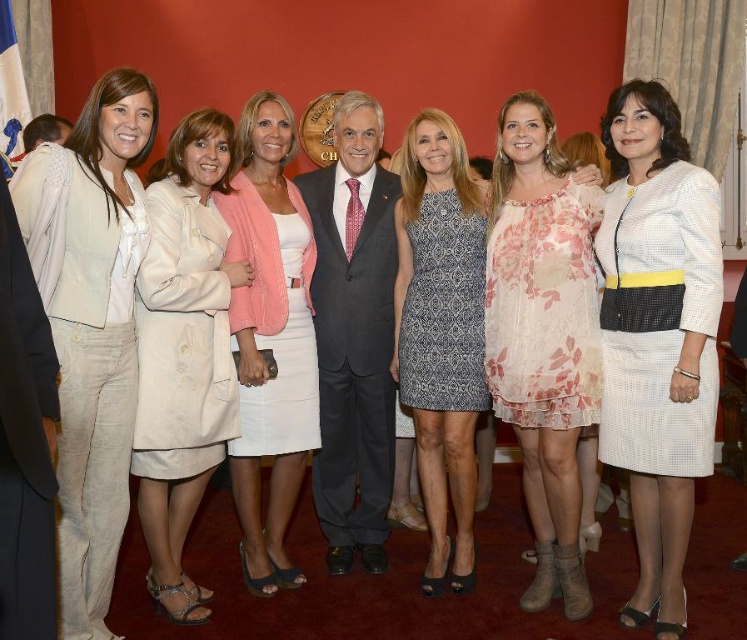
Is floral lace dress at center smaller than light beige fabric coat at center?

Correct, floral lace dress at center occupies less space than light beige fabric coat at center.

Is point (545, 148) closer to viewer compared to point (202, 609)?

No, (545, 148) is behind (202, 609).

This screenshot has width=747, height=640. Identify the location of floral lace dress at center. (542, 333).

Can you confirm if white textured dress at center is thinner than dark gray suit at center?

Indeed, white textured dress at center has a lesser width compared to dark gray suit at center.

Which is in front, point (697, 211) or point (388, 307)?

Positioned in front is point (697, 211).

At what (x,y) coordinates should I click in order to perform the action: click on white textured dress at center. Please return your answer as a coordinate pair (x, y). The height and width of the screenshot is (640, 747). Looking at the image, I should click on (657, 337).

Can you confirm if dark gray suit at center is positioned below printed fabric dress at center?

No.

Which is above, dark gray suit at center or printed fabric dress at center?

dark gray suit at center is above.

Where is `dark gray suit at center`? This screenshot has height=640, width=747. dark gray suit at center is located at coordinates point(353,336).